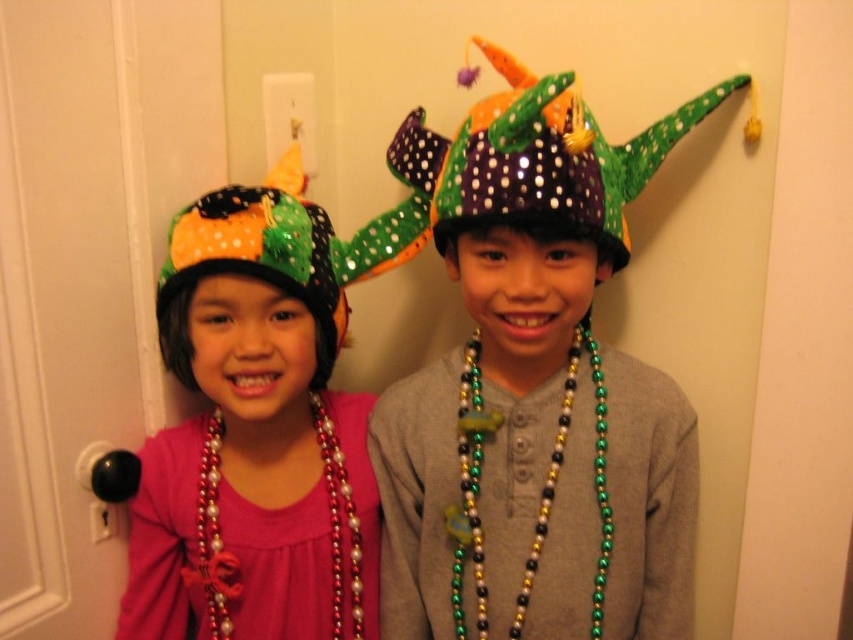
Question: Among these points, which one is nearest to the camera?

Choices:
 (A) (479, 339)
 (B) (236, 506)
 (C) (360, 547)
 (D) (605, 476)

Answer: (D)

Question: Can you confirm if shiny sequined hat at left is thinner than multicolored beads at center?

Choices:
 (A) yes
 (B) no

Answer: (B)

Question: Among these objects, which one is farthest from the camera?

Choices:
 (A) multicolored beads at center
 (B) sparkly purple and green hat at center

Answer: (A)

Question: Is shiny sequined party hat at left to the left of metallic beads necklace at center from the viewer's perspective?

Choices:
 (A) yes
 (B) no

Answer: (A)

Question: Is shiny sequined hat at left smaller than sparkly polka dot party hat at center?

Choices:
 (A) no
 (B) yes

Answer: (A)

Question: Which of the following is the farthest from the observer?

Choices:
 (A) coord(415,252)
 (B) coord(456,525)

Answer: (A)